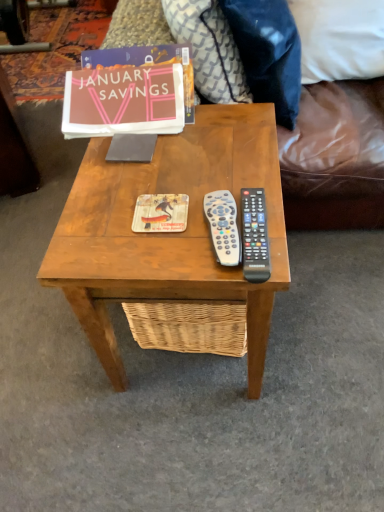
Where is `blank space situated above wooden coffee table at center (from a real-world perspective)`? blank space situated above wooden coffee table at center (from a real-world perspective) is located at coordinates (175, 170).